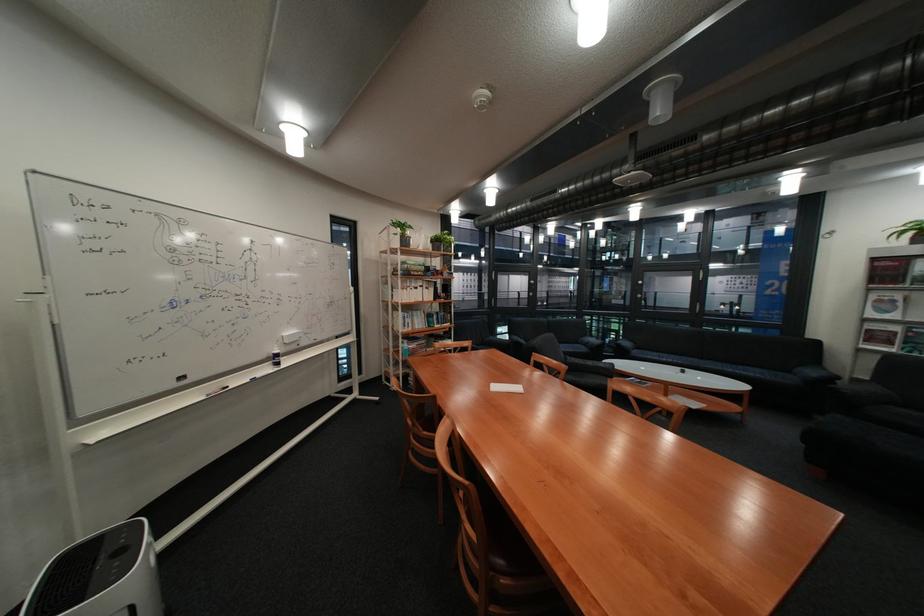
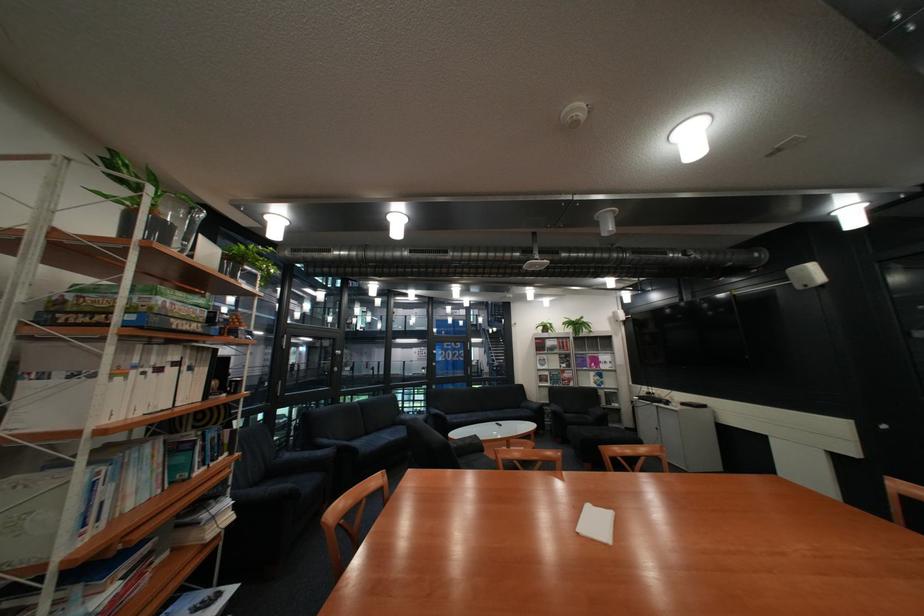
Locate, in the second image, the point that corresponds to pixel 686 360 in the first image.

(490, 418)